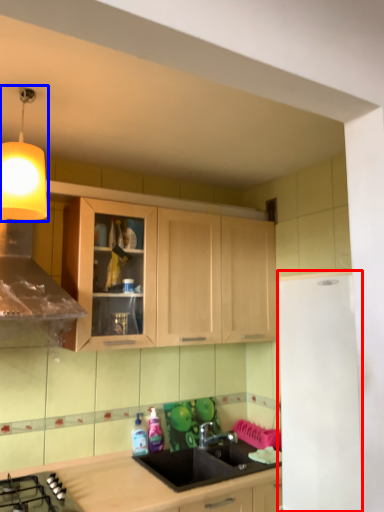
Question: Which of the following is the farthest to the observer, appliance (highlighted by a red box) or light fixture (highlighted by a blue box)?

Choices:
 (A) appliance
 (B) light fixture

Answer: (B)